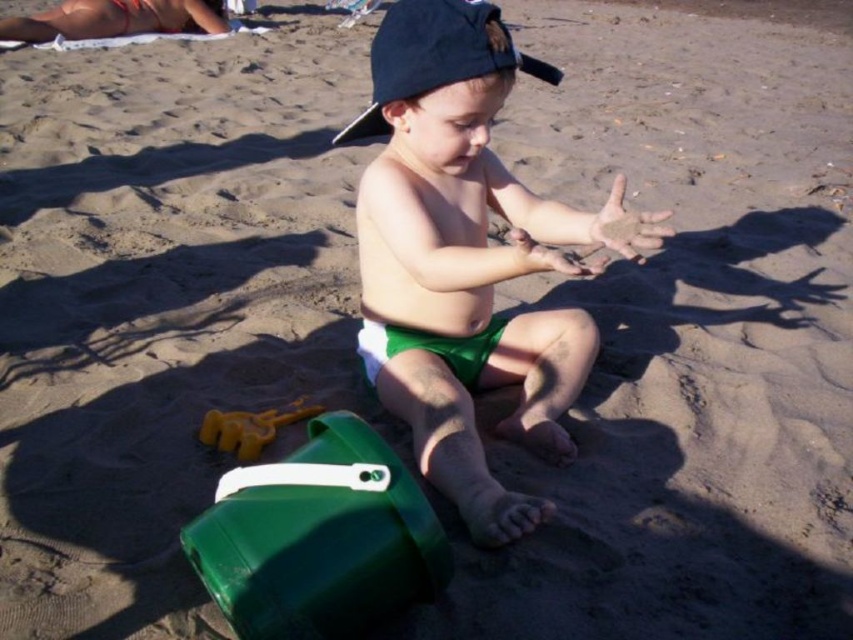
Question: Considering the real-world distances, which object is farthest from the green fabric toddler at center?

Choices:
 (A) green plastic bucket at lower left
 (B) black fabric cap at center

Answer: (A)

Question: Is green plastic bucket at lower left wider than yellow plastic shovel at lower left?

Choices:
 (A) no
 (B) yes

Answer: (B)

Question: Does green fabric toddler at center appear over green plastic bucket at lower left?

Choices:
 (A) yes
 (B) no

Answer: (A)

Question: Which object appears closest to the camera in this image?

Choices:
 (A) green fabric toddler at center
 (B) green plastic bucket at lower left

Answer: (B)

Question: Is green plastic bucket at lower left wider than yellow plastic shovel at lower left?

Choices:
 (A) no
 (B) yes

Answer: (B)

Question: Estimate the real-world distances between objects in this image. Which object is farther from the green fabric toddler at center?

Choices:
 (A) green plastic bucket at lower left
 (B) yellow plastic shovel at lower left

Answer: (B)